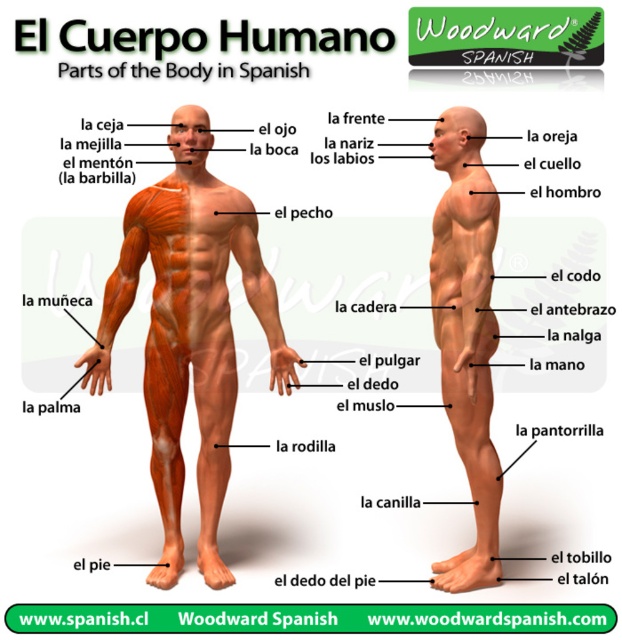
Who is more distant from viewer, (x=177, y=358) or (x=476, y=236)?

The point (x=177, y=358) is more distant.

Which is behind, point (185, 380) or point (442, 216)?

The point (185, 380) is more distant.

This screenshot has height=640, width=622. I want to click on matte orange muscle at center, so click(x=188, y=330).